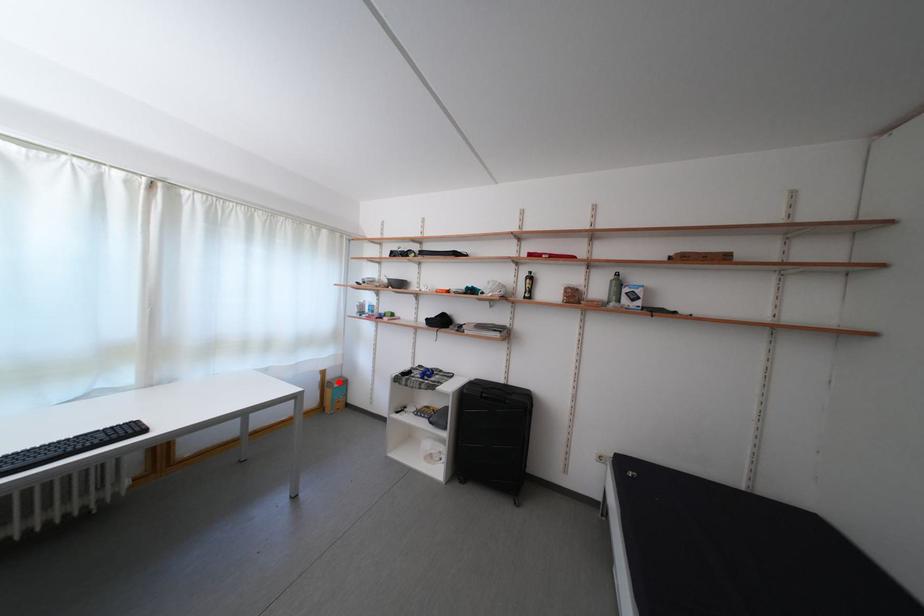
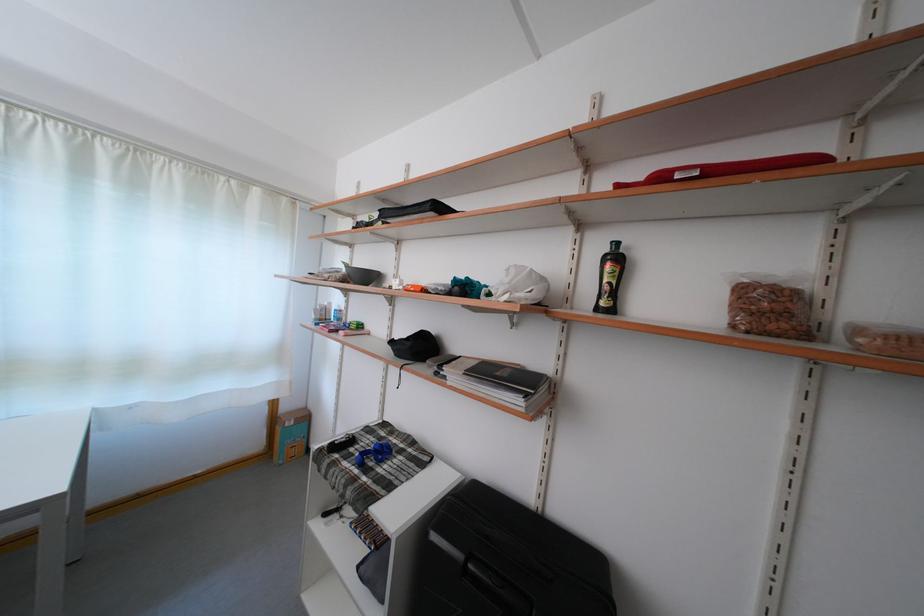
Question: I am providing you with two images of the same scene from different viewpoints. A red point is shown in image1. For the corresponding object point in image2, is it positioned nearer or farther from the camera?

Choices:
 (A) Nearer
 (B) Farther

Answer: (A)